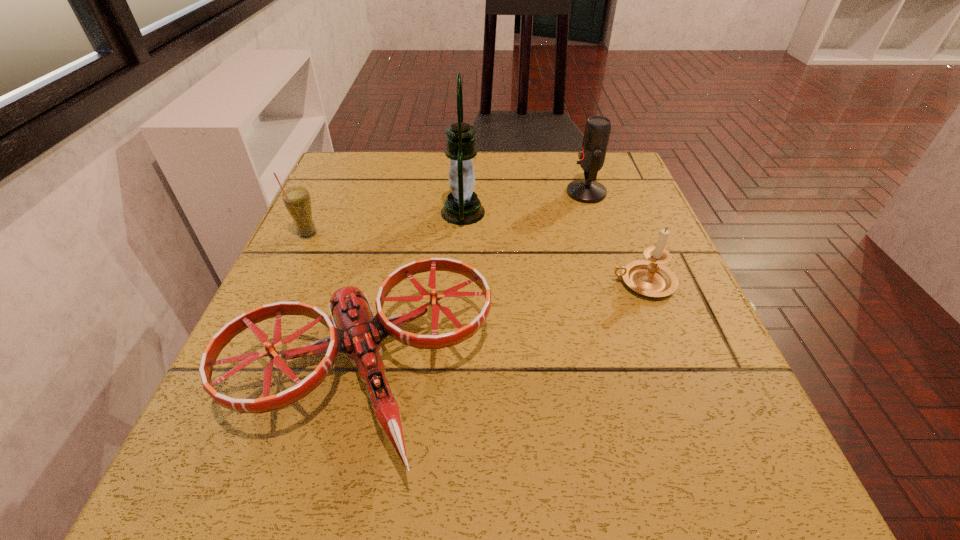
At what (x,y) coordinates should I click in order to perform the action: click on candle holder that is at the right edge. Please return your answer as a coordinate pair (x, y). The image size is (960, 540). Looking at the image, I should click on 650,278.

Locate an element on the screen. object located in the near left corner section of the desktop is located at coordinates (356, 331).

This screenshot has height=540, width=960. Find the location of `object at the far right corner`. object at the far right corner is located at coordinates (592, 154).

Locate an element on the screen. This screenshot has height=540, width=960. vacant space at the far edge of the desktop is located at coordinates (508, 178).

You are a GUI agent. You are given a task and a screenshot of the screen. Output one action in this format:
    pyautogui.click(x=<x>, y=<y>)
    Task: Click on the vacant position at the left edge of the desktop
    
    Given the screenshot: What is the action you would take?
    [334, 233]

Find the location of a particular element. This screenshot has height=540, width=960. free region at the right edge of the desktop is located at coordinates pyautogui.click(x=623, y=339).

Locate an element on the screen. vacant space at the far right corner of the desktop is located at coordinates (569, 157).

Locate an element on the screen. The width and height of the screenshot is (960, 540). empty location between the second shortest object and the microphone is located at coordinates (614, 238).

Locate an element on the screen. unoccupied area between the candle holder and the microphone is located at coordinates (614, 238).

Locate an element on the screen. The height and width of the screenshot is (540, 960). unoccupied area between the tallest object and the shortest object is located at coordinates (413, 294).